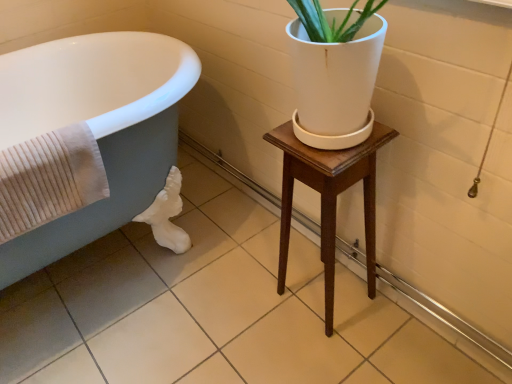
Question: Is point (169, 112) closer or farther from the camera than point (44, 215)?

Choices:
 (A) closer
 (B) farther

Answer: (B)

Question: Is matte gray bathtub at left situated inside beige ribbed towel at left or outside?

Choices:
 (A) outside
 (B) inside

Answer: (A)

Question: Based on their relative distances, which object is farther from the beige ribbed towel at left?

Choices:
 (A) wooden stool at center
 (B) matte gray bathtub at left

Answer: (A)

Question: Which of these objects is positioned closest to the wooden stool at center?

Choices:
 (A) beige ribbed towel at left
 (B) matte gray bathtub at left

Answer: (A)